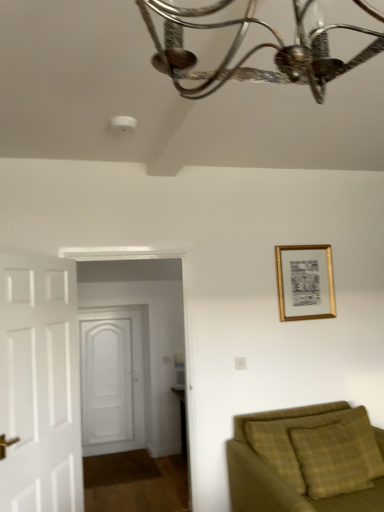
Question: Would you say gold metallic picture frame at upper right is to the left or to the right of white wooden door at left, acting as the 2th door starting from the back, in the picture?

Choices:
 (A) right
 (B) left

Answer: (A)

Question: Is gold metallic picture frame at upper right in front of or behind white wooden door at left, which ranks as the 1th door in front-to-back order, in the image?

Choices:
 (A) front
 (B) behind

Answer: (B)

Question: Based on their relative distances, which object is farther from the white wooden door at left, which ranks as the 1th door in front-to-back order?

Choices:
 (A) green plaid fabric couch at lower right
 (B) gold metallic picture frame at upper right
 (C) white wooden door at center, marked as the first door in a back-to-front arrangement

Answer: (C)

Question: Which object is positioned closest to the green plaid fabric couch at lower right?

Choices:
 (A) white wooden door at left, which ranks as the 1th door in front-to-back order
 (B) gold metallic picture frame at upper right
 (C) white wooden door at center, marked as the first door in a back-to-front arrangement

Answer: (B)